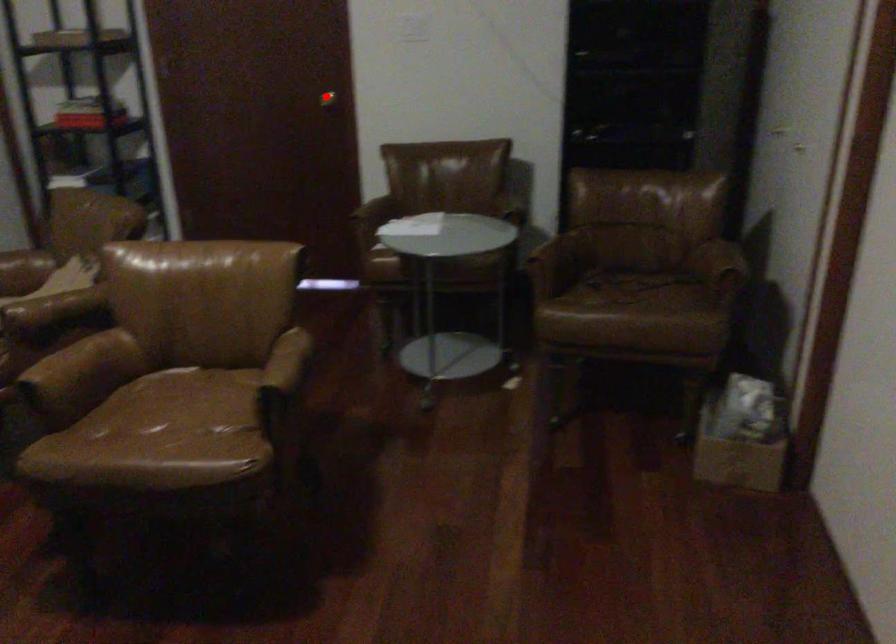
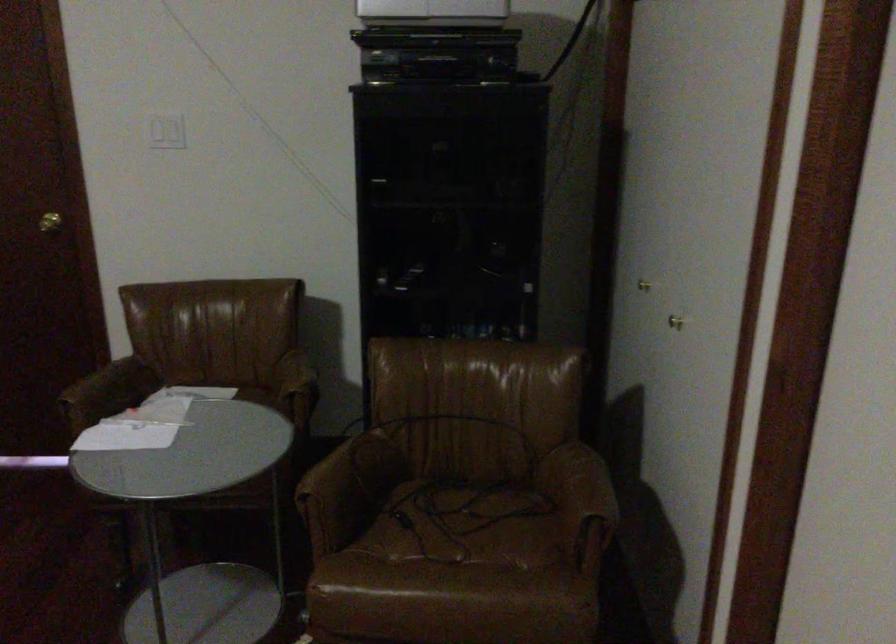
Find the pixel in the second image that matches the highlighted location in the first image.

(49, 222)